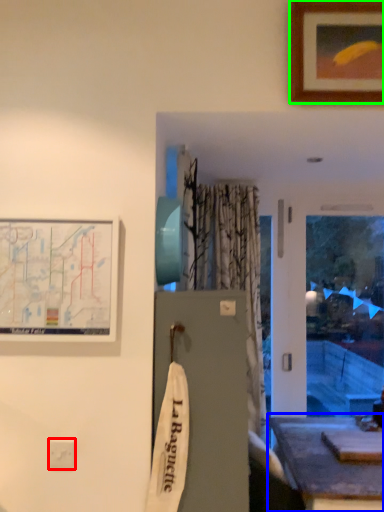
Question: Considering the real-world distances, which object is farthest from electric outlet (highlighted by a red box)? table (highlighted by a blue box) or picture frame (highlighted by a green box)?

Choices:
 (A) table
 (B) picture frame

Answer: (B)